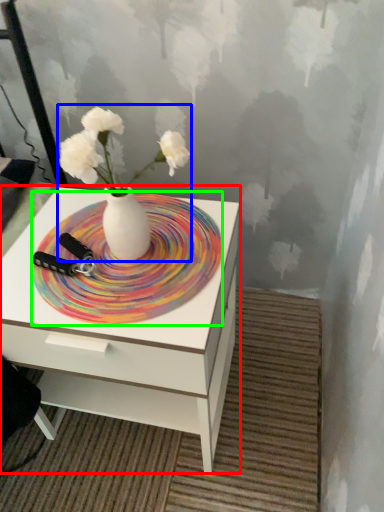
Question: Which object is the farthest from nightstand (highlighted by a red box)? Choose among these: floral arrangement (highlighted by a blue box) or plate (highlighted by a green box).

Choices:
 (A) floral arrangement
 (B) plate

Answer: (A)